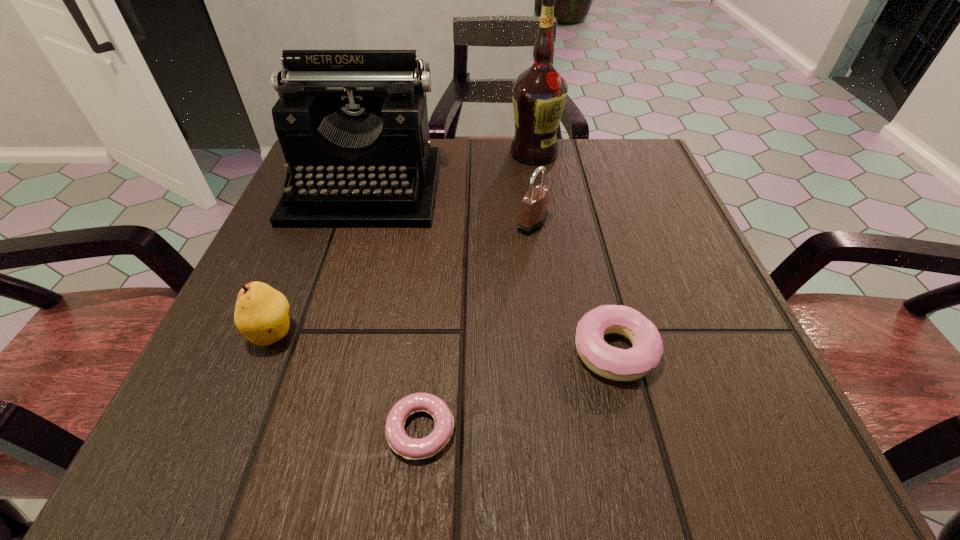
Identify the location of empty space that is in between the fourth tallest object and the fourth shortest object. Image resolution: width=960 pixels, height=540 pixels. (403, 278).

Identify the location of vacant space in between the fourth tallest object and the right doughnut. (444, 342).

Locate an element on the screen. The height and width of the screenshot is (540, 960). free space between the second shortest object and the tallest object is located at coordinates (574, 252).

Locate an element on the screen. The height and width of the screenshot is (540, 960). empty space that is in between the alcohol and the fifth tallest object is located at coordinates (574, 252).

You are a GUI agent. You are given a task and a screenshot of the screen. Output one action in this format:
    pyautogui.click(x=<x>, y=<y>)
    Task: Click on the vacant region between the typewriter and the taller doughnut
    The width and height of the screenshot is (960, 540).
    Given the screenshot: What is the action you would take?
    pyautogui.click(x=490, y=269)

You are a GUI agent. You are given a task and a screenshot of the screen. Output one action in this format:
    pyautogui.click(x=<x>, y=<y>)
    Task: Click on the vacant area that lies between the tallest object and the fifth shortest object
    The height and width of the screenshot is (540, 960).
    Given the screenshot: What is the action you would take?
    pyautogui.click(x=449, y=171)

Choose which object is the fourth nearest neighbor to the alcohol. Please provide its 2D coordinates. Your answer should be formatted as a tuple, i.e. [(x, y)], where the tuple contains the x and y coordinates of a point satisfying the conditions above.

[(261, 314)]

This screenshot has height=540, width=960. I want to click on the second closest object to the taller doughnut, so click(534, 204).

You are a GUI agent. You are given a task and a screenshot of the screen. Output one action in this format:
    pyautogui.click(x=<x>, y=<y>)
    Task: Click on the vacant space that satisfies the following two spatial constraints: 1. on the label of the taller doughnut; 2. on the right side of the tallest object
    
    Given the screenshot: What is the action you would take?
    pyautogui.click(x=566, y=351)

At what (x,y) coordinates should I click in order to perform the action: click on free region that satisfies the following two spatial constraints: 1. on the front side of the right doughnut; 2. on the right side of the fourth shortest object. Please return your answer as a coordinate pair (x, y). Image resolution: width=960 pixels, height=540 pixels. Looking at the image, I should click on (549, 351).